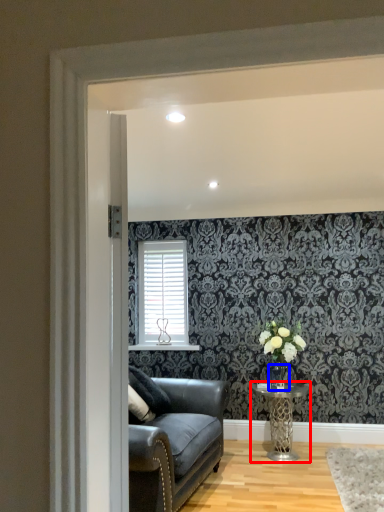
Question: Which object is further to the camera taking this photo, table (highlighted by a red box) or glass vase (highlighted by a blue box)?

Choices:
 (A) table
 (B) glass vase

Answer: (B)